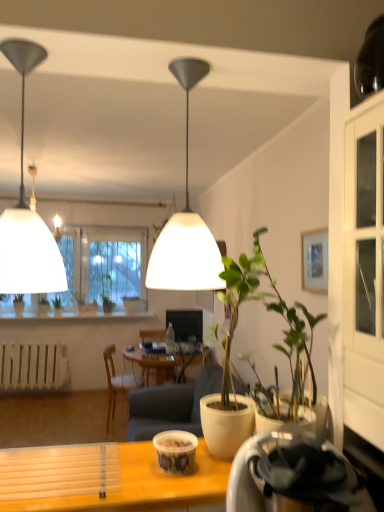
Question: Would you say green matte plant at lower left, which is the second houseplant from front to back, is inside or outside green matte plant at center, the 3th houseplant from the front?

Choices:
 (A) inside
 (B) outside

Answer: (B)

Question: Is green matte plant at lower left, which is the second houseplant from front to back, taller or shorter than green matte plant at center, the 2th houseplant from the left?

Choices:
 (A) tall
 (B) short

Answer: (B)

Question: Based on their relative distances, which object is nearer to the wooden chair at center?

Choices:
 (A) green matte plant at lower left, the 3th houseplant positioned from the back
 (B) green matte plant at center, the 2th houseplant from the left
 (C) white matte radiator at lower left
 (D) green leafy plant at center, the fourth houseplant when ordered from front to back
 (E) transparent glass window at left

Answer: (C)

Question: Which object is positioned farthest from the green matte plant at center, which is the fourth houseplant in left-to-right order?

Choices:
 (A) matte white lampshade at upper left, which ranks as the second lamp in right-to-left order
 (B) matte plastic cup at center
 (C) green matte plant at lower left, which is the second houseplant from front to back
 (D) white matte radiator at lower left
 (E) white matte lampshade at center, the 2th lamp when ordered from left to right

Answer: (C)